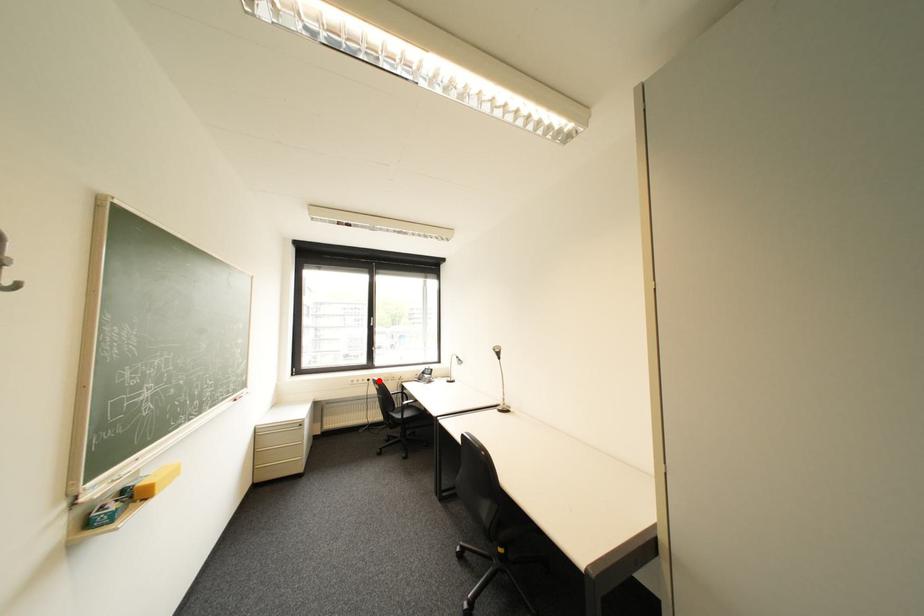
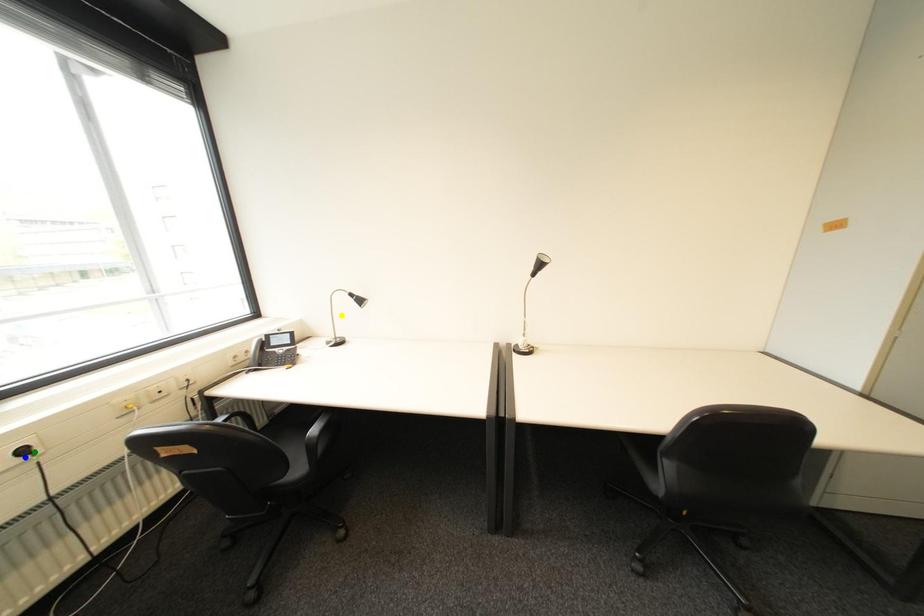
Question: I am providing you with two images of the same scene from different viewpoints. A red point is marked on the first image. You are given multiple points on the second image. In image 2, which mark is for the same physical point as the one in image 1?

Choices:
 (A) yellow point
 (B) blue point
 (C) green point

Answer: (C)